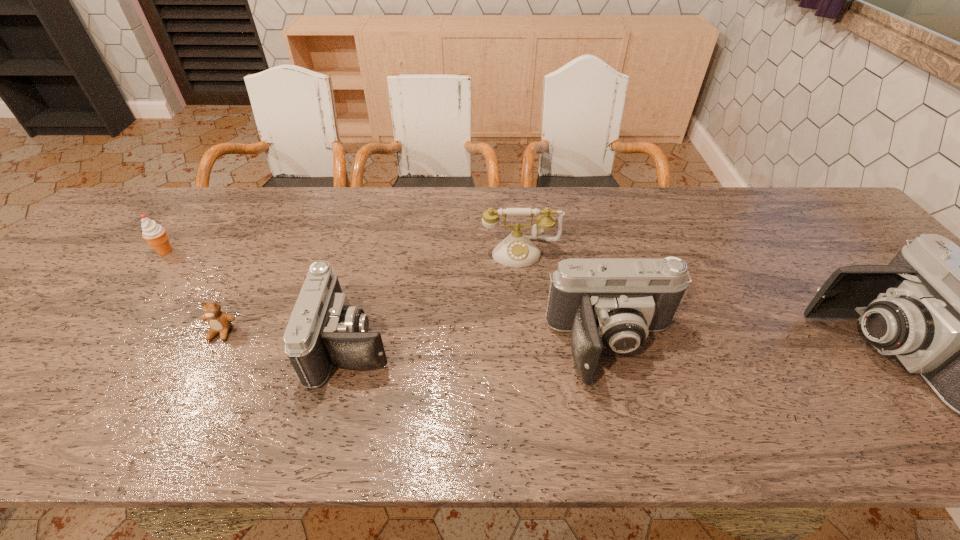
Please point a spot to add another camera on the left. Please provide its 2D coordinates. Your answer should be formatted as a tuple, i.e. [(x, y)], where the tuple contains the x and y coordinates of a point satisfying the conditions above.

[(97, 340)]